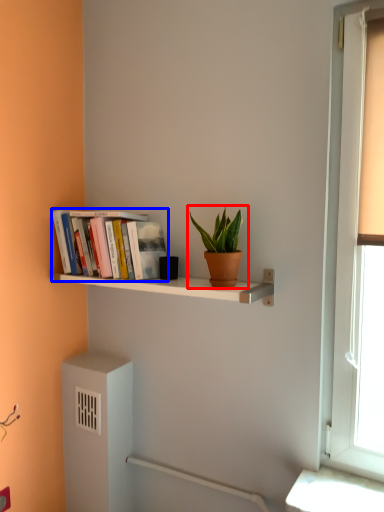
Question: Among these objects, which one is nearest to the camera, houseplant (highlighted by a red box) or book (highlighted by a blue box)?

Choices:
 (A) houseplant
 (B) book

Answer: (A)